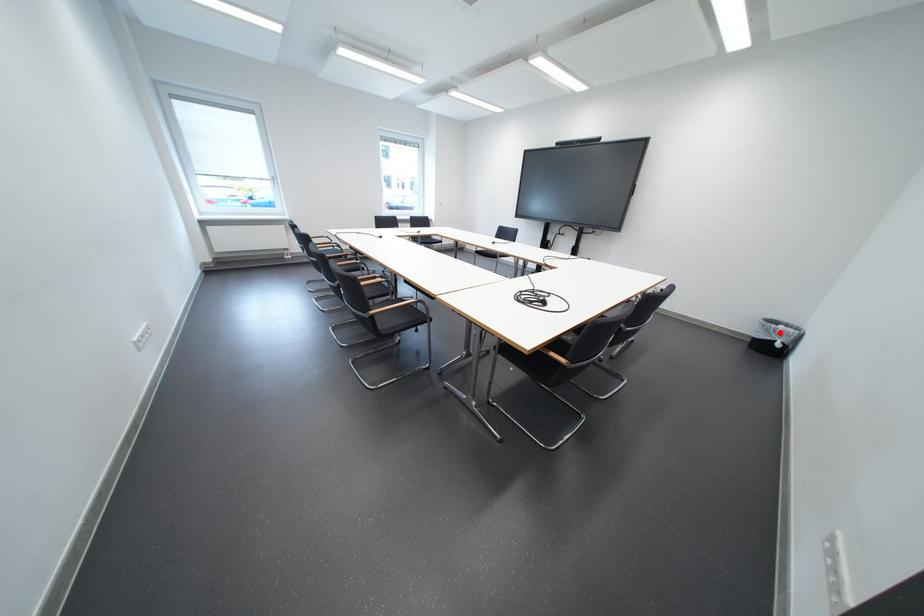
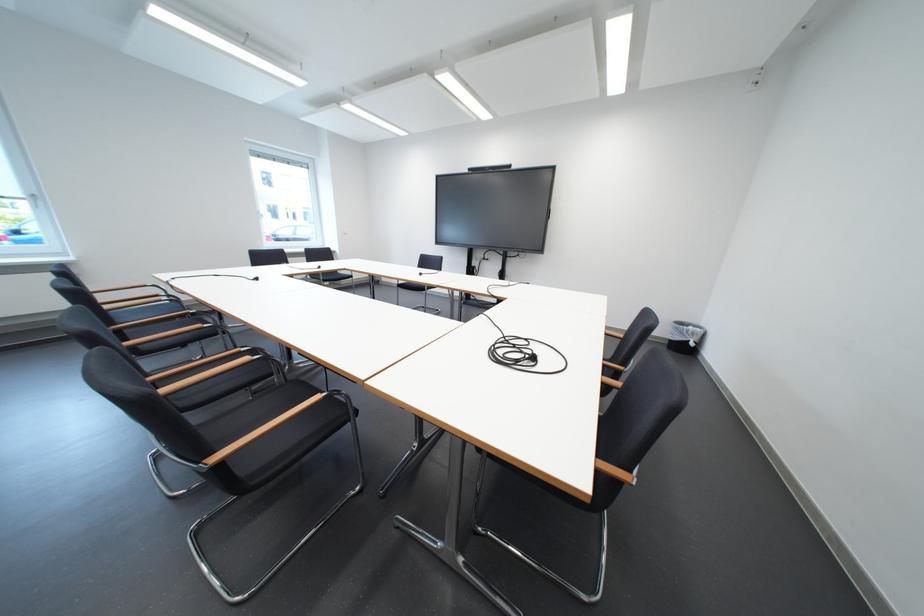
Question: I am providing you with two images of the same scene from different viewpoints. Image1 has a red point marked. In image2, the corresponding 3D location appears at what relative position? Reply with the corresponding letter.

Choices:
 (A) Closer
 (B) Farther

Answer: (B)